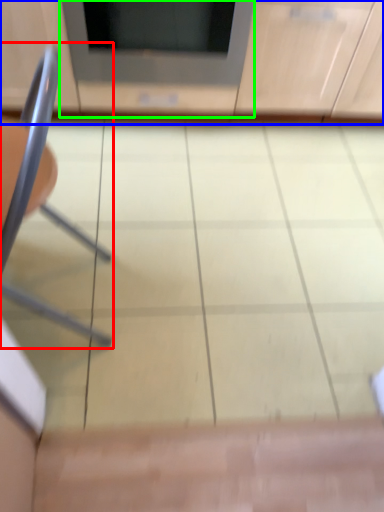
Question: Based on their relative distances, which object is farther from chair (highlighted by a red box)? Choose from cabinetry (highlighted by a blue box) and appliance (highlighted by a green box).

Choices:
 (A) cabinetry
 (B) appliance

Answer: (A)